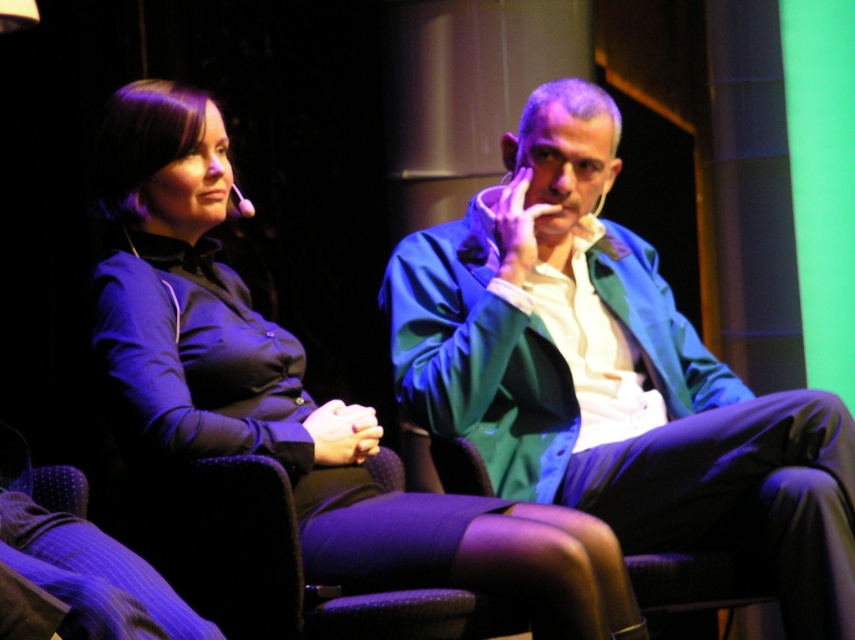
You are a photographer standing in front of the scene described. You want to take a closeup shot of the matte green blazer at center. Considering your current position, can you estimate if you need to move closer or farther away to achieve a closeup without using zoom?

The matte green blazer at center is 1.75 meters away from you. To take a closeup shot without zoom, you would need to move closer than 1.75 meters to get a tighter focus on the blazer.

You are an event planner arranging seating for a formal dinner. You need to place a matte green blazer at center and a matte black dress at center so that they are positioned correctly according to the image. Which item should be placed higher up?

The matte green blazer at center should be placed higher up because it is above the matte black dress at center in the image.